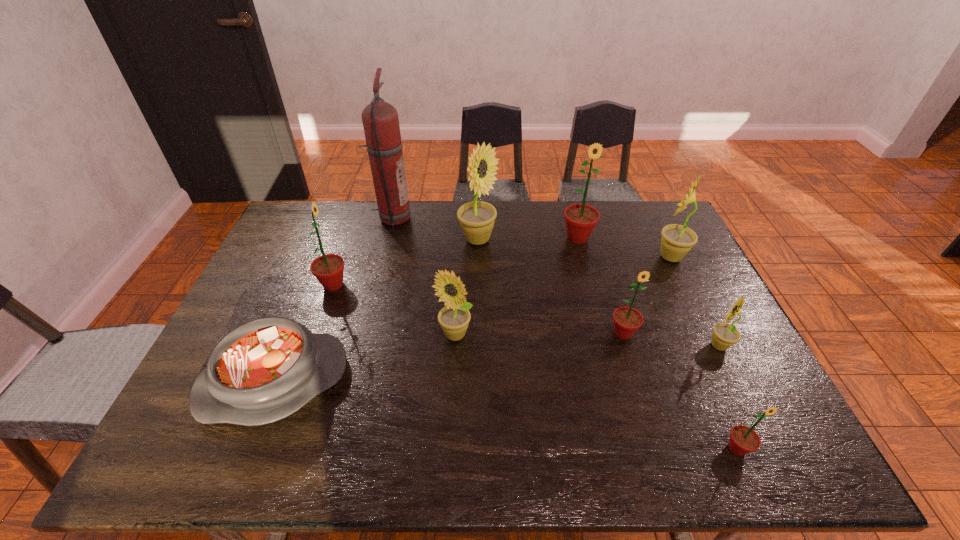
This screenshot has width=960, height=540. I want to click on object that is positioned at the left edge, so click(x=264, y=370).

Find the location of a particular element. The image size is (960, 540). object that is at the near left corner is located at coordinates (264, 370).

The height and width of the screenshot is (540, 960). I want to click on object that is at the near right corner, so click(x=743, y=439).

Where is `vacant space at the far edge of the desktop`? vacant space at the far edge of the desktop is located at coordinates (376, 240).

In the image, there is a desktop. What are the coordinates of `vacant space at the near edge` in the screenshot? It's located at (488, 465).

The height and width of the screenshot is (540, 960). In order to click on free spot at the right edge of the desktop in this screenshot , I will do `click(655, 276)`.

Locate an element on the screen. The image size is (960, 540). free space at the near left corner of the desktop is located at coordinates (185, 446).

This screenshot has height=540, width=960. In order to click on vacant point at the far right corner in this screenshot , I will do `click(653, 224)`.

At what (x,y) coordinates should I click in order to perform the action: click on empty space that is in between the smallest green sunflower and the red fire extinguisher. Please return your answer as a coordinate pair (x, y). This screenshot has height=540, width=960. Looking at the image, I should click on (564, 334).

At what (x,y) coordinates should I click in order to perform the action: click on empty space that is in between the smallest yellow sunflower and the tallest object. Please return your answer as a coordinate pair (x, y). The height and width of the screenshot is (540, 960). Looking at the image, I should click on (556, 282).